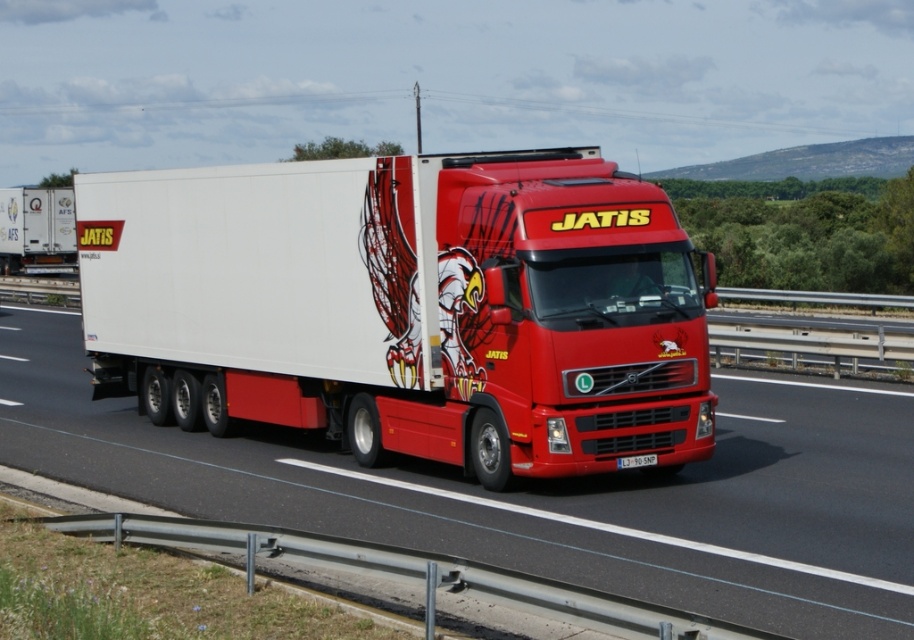
You are a truck driver who needs to load cargo onto the matte white trailer at center and the white glossy trailer at center. Which trailer can accommodate larger items?

The matte white trailer at center is bigger than the white glossy trailer at center, so it can accommodate larger items.

Consider the image. You are a delivery driver who needs to check the license plate number of the white plastic license plate at center. However, the matte white trailer at center is blocking your view. Can you determine if the license plate is visible from your current position?

The matte white trailer at center is positioned over white plastic license plate at center, so the license plate is not visible from your current position.

You are a delivery driver who needs to pass under a low bridge that has a height restriction sign indicating 2.5 meters. You are currently driving a large red and white semi truck with a matte white trailer at center and a white plastic license plate at center. Can you safely pass under the bridge without hitting it?

The matte white trailer at center has a greater height compared to the white plastic license plate at center. Since the license plate is at center, its height is likely below the trailer. However, the trailer is the taller object. If the trailer exceeds 2.5 meters in height, it might hit the bridge. Without specific height measurements, it is uncertain whether the truck can safely pass under the bridge.